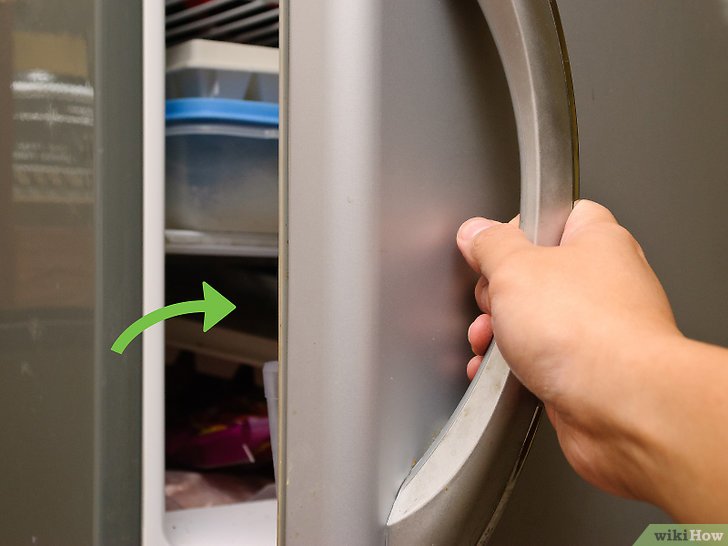
The height and width of the screenshot is (546, 728). I want to click on plastic storage container, so click(x=221, y=185).